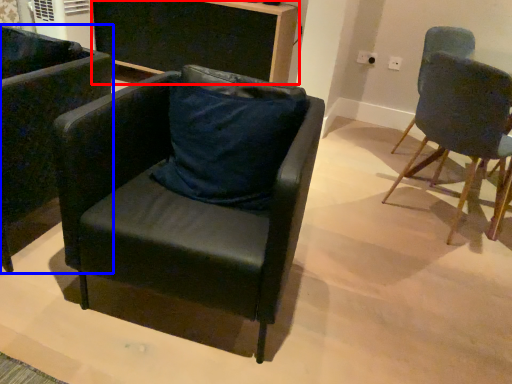
Question: Which object is closer to the camera taking this photo, desk (highlighted by a red box) or chair (highlighted by a blue box)?

Choices:
 (A) desk
 (B) chair

Answer: (B)